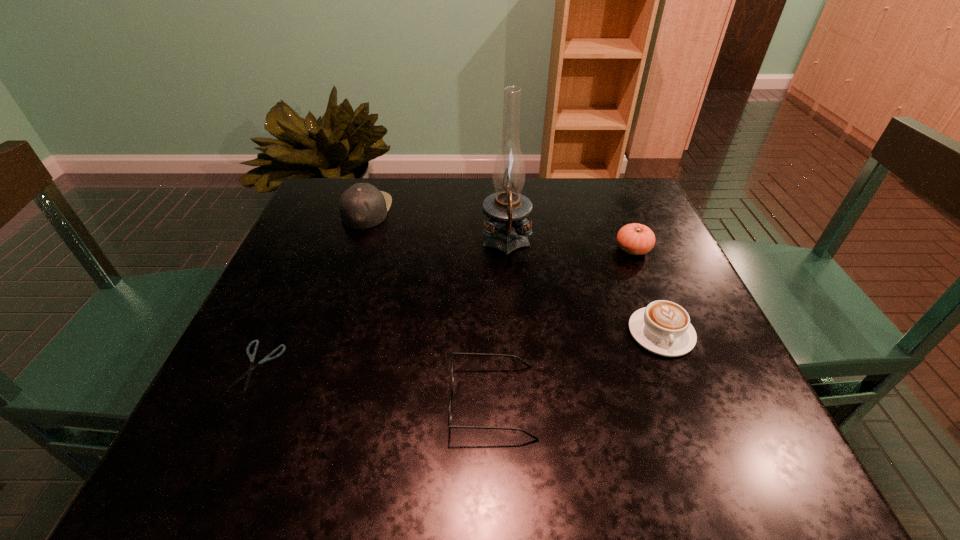
Where is `object that stands as the third closest to the cappuccino`? This screenshot has width=960, height=540. object that stands as the third closest to the cappuccino is located at coordinates (506, 209).

In order to click on free location that satisfies the following two spatial constraints: 1. on the brim of the second object from left to right; 2. on the back side of the third tallest object in this screenshot , I will do `click(353, 249)`.

I want to click on vacant area in the image that satisfies the following two spatial constraints: 1. on the brim of the tomato; 2. on the right side of the second object from left to right, so click(x=353, y=249).